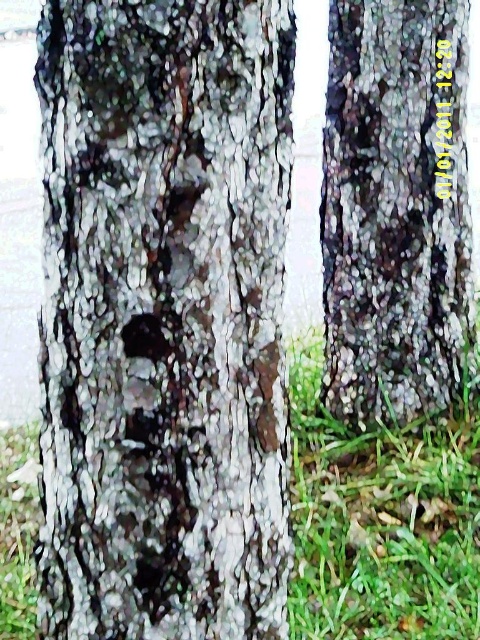
Question: Which object is farther from the camera taking this photo?

Choices:
 (A) green grass at center
 (B) dark gray bark tree at right
 (C) dark gray bark tree trunk at center

Answer: (B)

Question: Which object appears closest to the camera in this image?

Choices:
 (A) dark gray bark tree trunk at center
 (B) dark gray bark tree at right
 (C) green grass at center

Answer: (A)

Question: Observing the image, what is the correct spatial positioning of dark gray bark tree at right in reference to green grass at center?

Choices:
 (A) right
 (B) left

Answer: (A)

Question: Does dark gray bark tree at right appear over green grass at center?

Choices:
 (A) no
 (B) yes

Answer: (B)

Question: Which point is closer to the camera?

Choices:
 (A) dark gray bark tree trunk at center
 (B) green grass at center

Answer: (A)

Question: Is dark gray bark tree trunk at center above dark gray bark tree at right?

Choices:
 (A) no
 (B) yes

Answer: (A)